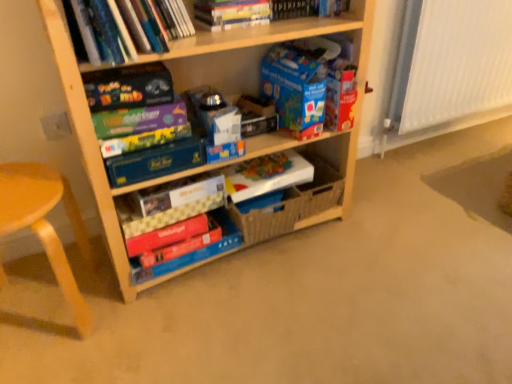
Question: Considering the relative positions of white paper at center, arranged as the 6th paperback book when viewed from the top, and matte black board game at upper left, which is counted as the 2th paperback book, starting from the top, in the image provided, is white paper at center, arranged as the 6th paperback book when viewed from the top, to the right of matte black board game at upper left, which is counted as the 2th paperback book, starting from the top, from the viewer's perspective?

Choices:
 (A) yes
 (B) no

Answer: (A)

Question: Can we say white paper at center, which is counted as the third paperback book, starting from the bottom, lies outside matte black board game at upper left, the 7th paperback book from the bottom?

Choices:
 (A) no
 (B) yes

Answer: (B)

Question: Does white paper at center, arranged as the 6th paperback book when viewed from the top, have a smaller size compared to matte black board game at upper left, which is counted as the 2th paperback book, starting from the top?

Choices:
 (A) yes
 (B) no

Answer: (B)

Question: Is white paper at center, arranged as the 6th paperback book when viewed from the top, turned away from matte black board game at upper left, which is counted as the 2th paperback book, starting from the top?

Choices:
 (A) yes
 (B) no

Answer: (B)

Question: Does white paper at center, which is counted as the third paperback book, starting from the bottom, have a greater width compared to matte black board game at upper left, the 7th paperback book from the bottom?

Choices:
 (A) yes
 (B) no

Answer: (A)

Question: Which is correct: hardcover book at upper center, which is counted as the 1th book, starting from the top, is inside blue cardboard book at center, the 4th paperback book from the bottom, or outside of it?

Choices:
 (A) outside
 (B) inside

Answer: (A)

Question: From the image's perspective, is hardcover book at upper center, which is counted as the 1th book, starting from the top, above or below blue cardboard book at center, the 4th paperback book from the bottom?

Choices:
 (A) below
 (B) above

Answer: (B)

Question: Considering the positions of point click(x=322, y=8) and point click(x=169, y=150), is point click(x=322, y=8) closer or farther from the camera than point click(x=169, y=150)?

Choices:
 (A) farther
 (B) closer

Answer: (A)

Question: Looking at their shapes, would you say hardcover book at upper center, the 4th book ordered from the bottom, is wider or thinner than blue cardboard book at center, the 4th paperback book from the bottom?

Choices:
 (A) thin
 (B) wide

Answer: (A)

Question: Considering the positions of point (199, 225) and point (28, 208), is point (199, 225) closer or farther from the camera than point (28, 208)?

Choices:
 (A) farther
 (B) closer

Answer: (A)

Question: Is matte red book at center, the first paperback book when ordered from bottom to top, bigger or smaller than wooden at left?

Choices:
 (A) small
 (B) big

Answer: (A)

Question: From the image's perspective, is matte red book at center, the first paperback book when ordered from bottom to top, above or below wooden at left?

Choices:
 (A) below
 (B) above

Answer: (B)

Question: From a real-world perspective, is matte red book at center, which appears as the 8th paperback book when viewed from the top, physically located above or below wooden at left?

Choices:
 (A) below
 (B) above

Answer: (A)

Question: Does point (58, 61) appear closer or farther from the camera than point (256, 170)?

Choices:
 (A) farther
 (B) closer

Answer: (B)

Question: Is wooden shelf at center in front of or behind white paper at center, arranged as the 6th paperback book when viewed from the top, in the image?

Choices:
 (A) front
 (B) behind

Answer: (A)